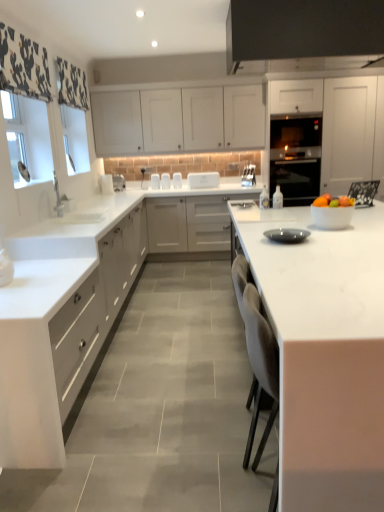
Question: Does white glossy bowl at right have a greater height compared to white marble countertop at center, the first countertop when ordered from right to left?

Choices:
 (A) yes
 (B) no

Answer: (B)

Question: Can you confirm if white glossy bowl at right is smaller than white marble countertop at center, the first countertop when ordered from right to left?

Choices:
 (A) no
 (B) yes

Answer: (B)

Question: Is white marble countertop at center, the second countertop positioned from the left, at the back of white glossy bowl at right?

Choices:
 (A) yes
 (B) no

Answer: (B)

Question: From a real-world perspective, does white glossy bowl at right sit lower than white marble countertop at center, the first countertop when ordered from right to left?

Choices:
 (A) yes
 (B) no

Answer: (B)

Question: From the image's perspective, is white glossy bowl at right on top of white marble countertop at center, the second countertop positioned from the left?

Choices:
 (A) no
 (B) yes

Answer: (B)

Question: Can you confirm if white glossy bowl at right is positioned to the left of white marble countertop at center, the first countertop when ordered from right to left?

Choices:
 (A) yes
 (B) no

Answer: (A)

Question: Does white glass window screen at left appear on the right side of black glass oven at center?

Choices:
 (A) yes
 (B) no

Answer: (B)

Question: Can you confirm if white glass window screen at left is taller than black glass oven at center?

Choices:
 (A) yes
 (B) no

Answer: (B)

Question: Does white glass window screen at left have a larger size compared to black glass oven at center?

Choices:
 (A) yes
 (B) no

Answer: (B)

Question: Does white glass window screen at left have a lesser height compared to black glass oven at center?

Choices:
 (A) no
 (B) yes

Answer: (B)

Question: Is white glass window screen at left smaller than black glass oven at center?

Choices:
 (A) no
 (B) yes

Answer: (B)

Question: From the image's perspective, would you say white glass window screen at left is positioned over black glass oven at center?

Choices:
 (A) no
 (B) yes

Answer: (B)

Question: Would you consider white matte cabinet at left, the first cabinetry positioned from the left, to be distant from white matte cabinet at upper center, the second cabinetry when ordered from left to right?

Choices:
 (A) yes
 (B) no

Answer: (A)